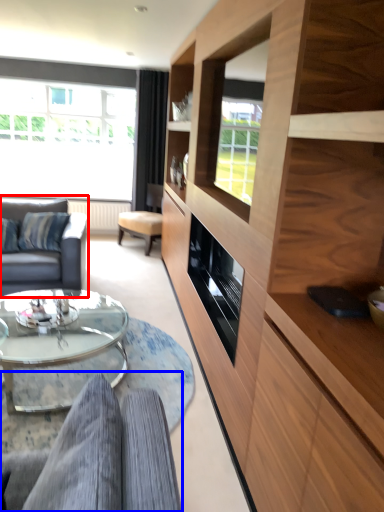
Question: Which of the following is the farthest to the observer, studio couch (highlighted by a red box) or studio couch (highlighted by a blue box)?

Choices:
 (A) studio couch
 (B) studio couch

Answer: (A)